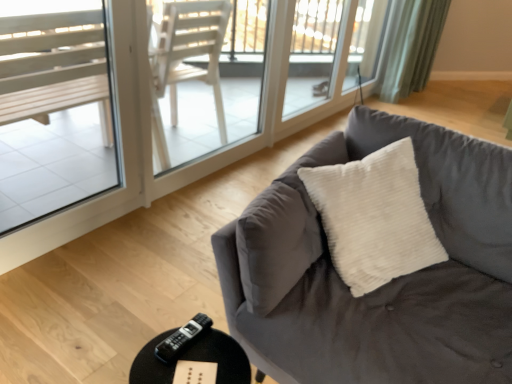
This screenshot has height=384, width=512. I want to click on free location in front of black plastic remote at lower center, so click(184, 368).